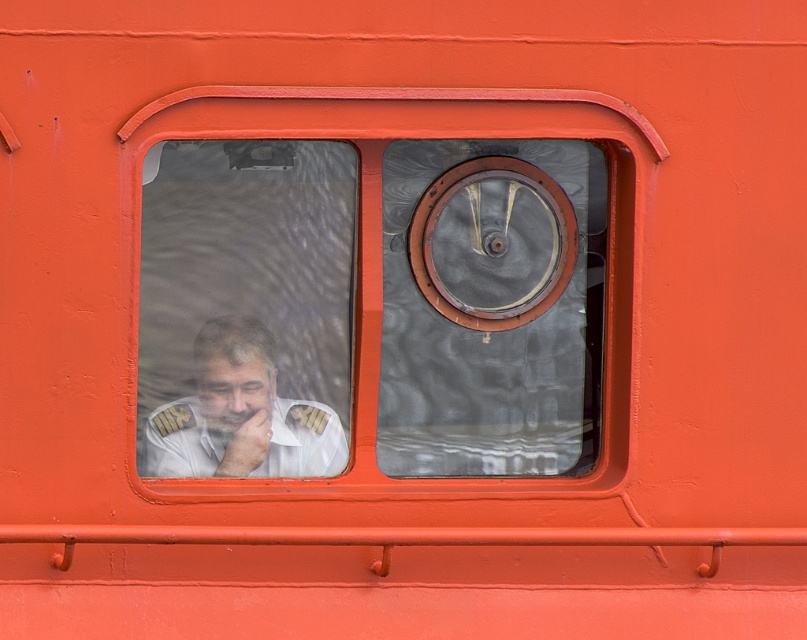
Question: Is transparent glass window at center closer to camera compared to white uniform at left?

Choices:
 (A) yes
 (B) no

Answer: (A)

Question: Does transparent glass window at center come in front of white uniform at left?

Choices:
 (A) no
 (B) yes

Answer: (B)

Question: Which point is farther from the camera taking this photo?

Choices:
 (A) (536, 253)
 (B) (245, 467)

Answer: (A)

Question: Is transparent glass window at center closer to the viewer compared to white uniform at left?

Choices:
 (A) yes
 (B) no

Answer: (A)